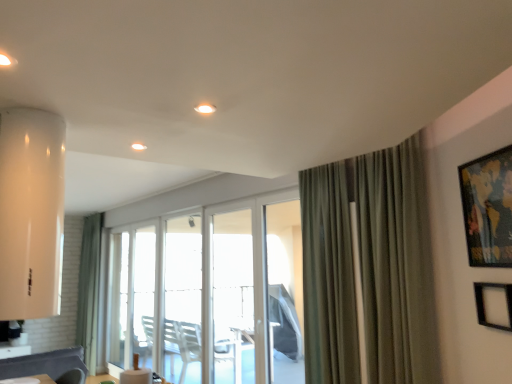
Question: Is clear glass door at center wider than transparent plastic screen door at center, arranged as the second screen door when viewed from the left?

Choices:
 (A) yes
 (B) no

Answer: (B)

Question: Could you tell me if clear glass door at center is facing transparent plastic screen door at center, arranged as the first screen door when viewed from the right?

Choices:
 (A) yes
 (B) no

Answer: (B)

Question: Considering the relative positions of clear glass door at center and transparent plastic screen door at center, arranged as the first screen door when viewed from the right, in the image provided, is clear glass door at center in front of transparent plastic screen door at center, arranged as the first screen door when viewed from the right,?

Choices:
 (A) no
 (B) yes

Answer: (A)

Question: Is clear glass door at center next to transparent plastic screen door at center, arranged as the second screen door when viewed from the left?

Choices:
 (A) no
 (B) yes

Answer: (A)

Question: From the image's perspective, does clear glass door at center appear lower than transparent plastic screen door at center, arranged as the first screen door when viewed from the right?

Choices:
 (A) yes
 (B) no

Answer: (A)

Question: Is point (140, 145) closer or farther from the camera than point (34, 375)?

Choices:
 (A) farther
 (B) closer

Answer: (B)

Question: Considering their positions, is white glossy light at upper center, the 2th light viewed from the top, located in front of or behind white glossy table at lower left?

Choices:
 (A) behind
 (B) front

Answer: (B)

Question: From the image's perspective, is white glossy light at upper center, which ranks as the second light in front-to-back order, positioned above or below white glossy table at lower left?

Choices:
 (A) above
 (B) below

Answer: (A)

Question: From a real-world perspective, relative to white glossy table at lower left, is white glossy light at upper center, the 2th light viewed from the top, vertically above or below?

Choices:
 (A) above
 (B) below

Answer: (A)

Question: Is clear glass door at center wider or thinner than wooden framed map at upper right, the first picture frame from the top?

Choices:
 (A) wide
 (B) thin

Answer: (A)

Question: Do you think clear glass door at center is within wooden framed map at upper right, marked as the second picture frame in a bottom-to-top arrangement, or outside of it?

Choices:
 (A) inside
 (B) outside

Answer: (B)

Question: In terms of size, does clear glass door at center appear bigger or smaller than wooden framed map at upper right, the first picture frame from the top?

Choices:
 (A) big
 (B) small

Answer: (A)

Question: Is point (141, 342) positioned closer to the camera than point (504, 155)?

Choices:
 (A) farther
 (B) closer

Answer: (A)

Question: From the image's perspective, is clear glass screen door at center, which is the second screen door in right-to-left order, positioned above or below transparent plastic screen door at center, arranged as the second screen door when viewed from the left?

Choices:
 (A) below
 (B) above

Answer: (A)

Question: Which is correct: clear glass screen door at center, which is the second screen door in right-to-left order, is inside transparent plastic screen door at center, arranged as the first screen door when viewed from the right, or outside of it?

Choices:
 (A) inside
 (B) outside

Answer: (B)